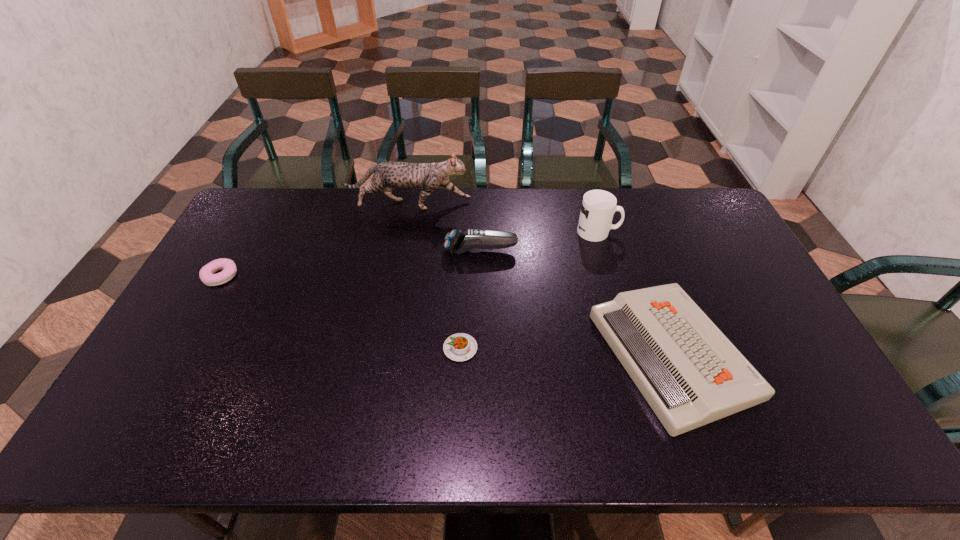
The height and width of the screenshot is (540, 960). In order to click on the tallest object in this screenshot , I will do `click(388, 175)`.

At what (x,y) coordinates should I click in order to perform the action: click on the farthest object. Please return your answer as a coordinate pair (x, y). Looking at the image, I should click on (388, 175).

Identify the location of the second farthest object. This screenshot has width=960, height=540. (598, 207).

The height and width of the screenshot is (540, 960). In order to click on the fifth shortest object in this screenshot , I will do `click(598, 207)`.

Identify the location of the fourth shortest object. This screenshot has width=960, height=540. (460, 242).

You are a GUI agent. You are given a task and a screenshot of the screen. Output one action in this format:
    pyautogui.click(x=<x>, y=<y>)
    Task: Click on the electric shaver
    
    Given the screenshot: What is the action you would take?
    pyautogui.click(x=460, y=242)

Locate an element on the screen. Image resolution: width=960 pixels, height=540 pixels. the third shortest object is located at coordinates (688, 371).

The image size is (960, 540). Find the location of `the fourth farthest object`. the fourth farthest object is located at coordinates (206, 274).

Find the location of a particular element. The image size is (960, 540). the leftmost object is located at coordinates point(206,274).

Where is `the shortest object`? The image size is (960, 540). the shortest object is located at coordinates (459, 347).